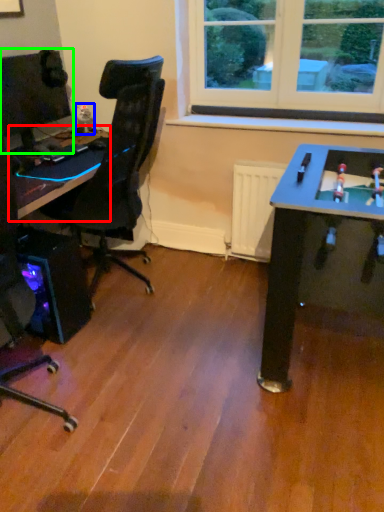
Question: Based on their relative distances, which object is farther from table (highlighted by a red box)? Choose from toy (highlighted by a blue box) and computer monitor (highlighted by a green box).

Choices:
 (A) toy
 (B) computer monitor

Answer: (A)